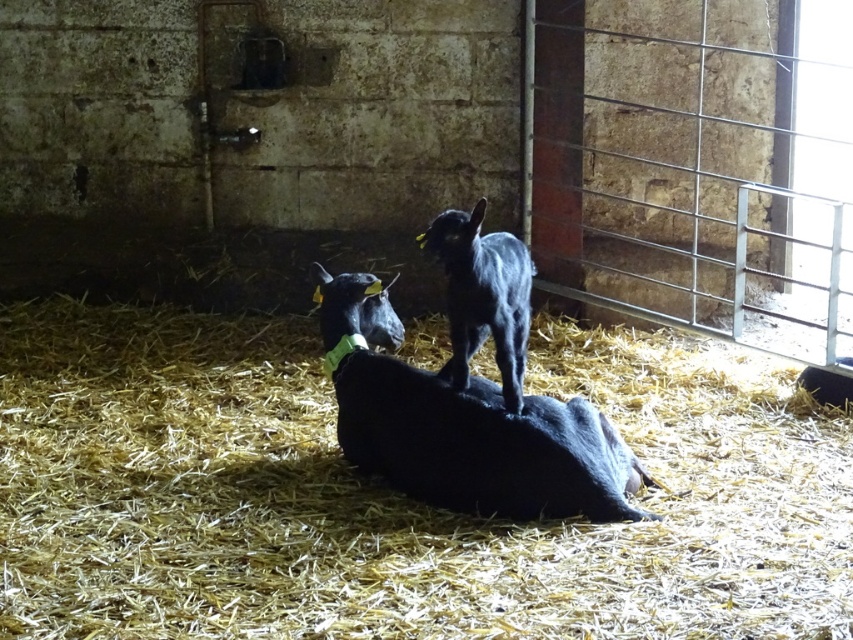
You are a farmer who needs to separate two goats for feeding. The black matte goat at center and the black furry goat at center are currently too close to each other. What is the minimum distance you need to move them apart to ensure they are at least 1 meter apart?

The black matte goat at center and the black furry goat at center are currently 30.78 centimeters apart. To reach the required 1 meter separation, you need to move them apart by an additional 69.22 centimeters.

You are a farmer checking the barn. You need to place a new hay bale between the yellow straw at center and the black furry goat at center. Can you fit the hay bale if it requires 4 feet of space?

The distance between the yellow straw at center and the black furry goat at center is 3.29 feet, which is less than the required 4 feet for the hay bale. Therefore, the hay bale cannot be placed between them.

You are a farmer checking the barn. You need to place a new feeding trough that requires 2 square meters of space. The yellow straw at center and the black matte goat at center are in the way. Which object should you move to free up enough space?

The yellow straw at center is larger in size than the black matte goat at center, so moving the yellow straw at center would free up more space for the feeding trough.